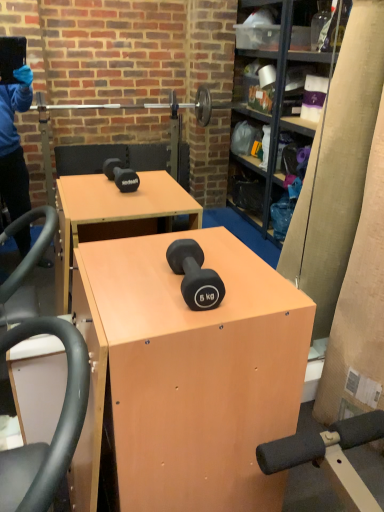
At what (x,y) coordinates should I click in order to perform the action: click on vacant space situated above light brown wood desk at center (from a real-world perspective). Please return your answer as a coordinate pair (x, y). The width and height of the screenshot is (384, 512). Looking at the image, I should click on (165, 280).